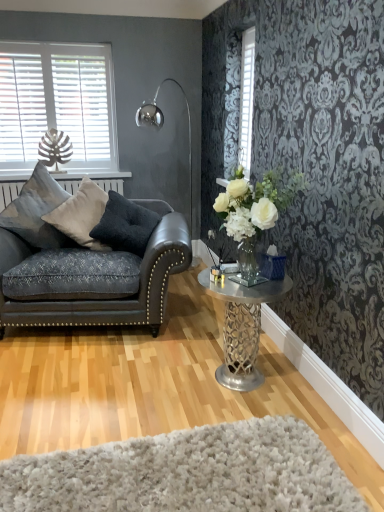
Question: Considering the positions of point (19, 229) and point (155, 117), is point (19, 229) closer or farther from the camera than point (155, 117)?

Choices:
 (A) farther
 (B) closer

Answer: (B)

Question: From a real-world perspective, is velvet cushion at left, which appears as the 3th pillow when viewed from the right, positioned above or below metallic silver floor lamp at upper left?

Choices:
 (A) below
 (B) above

Answer: (A)

Question: Which object is the closest to the dark gray velvet pillow at left, which is the 1th pillow in right-to-left order?

Choices:
 (A) metallic silver floor lamp at upper left
 (B) velvet cushion at left, which is the second pillow in left-to-right order
 (C) dark gray leather couch at left
 (D) white glass vase at center right
 (E) metallic silver table at center

Answer: (B)

Question: Considering the real-world distances, which object is farthest from the metallic silver table at center?

Choices:
 (A) dark gray velvet pillow at left, which is the 1th pillow in right-to-left order
 (B) velvet cushion at left, the 2th pillow from the right
 (C) white shaggy rug at lower center
 (D) white textured blinds at upper center, the first window from the right
 (E) metallic silver floor lamp at upper left

Answer: (E)